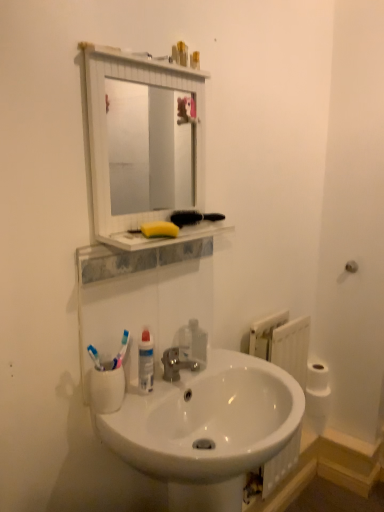
I want to click on white plastic radiator at lower right, so click(x=282, y=343).

Where is `white glossy sink at center`? This screenshot has width=384, height=512. white glossy sink at center is located at coordinates (210, 429).

The width and height of the screenshot is (384, 512). What do you see at coordinates (182, 53) in the screenshot? I see `translucent plastic container at upper center` at bounding box center [182, 53].

In order to face white matte toilet paper at right, should I rotate leftwards or rightwards?

It's best to rotate right around 16.304 degrees.

You are a GUI agent. You are given a task and a screenshot of the screen. Output one action in this format:
    pyautogui.click(x=<x>, y=<y>)
    Task: Click on the white plastic radiator at lower right
    The height and width of the screenshot is (512, 384).
    Given the screenshot: What is the action you would take?
    pyautogui.click(x=282, y=343)

Is white plastic radiator at lower right next to silver metallic faucet at center and touching it?

No, white plastic radiator at lower right is not in contact with silver metallic faucet at center.

How many degrees apart are the facing directions of white plastic radiator at lower right and silver metallic faucet at center?

The facing directions of white plastic radiator at lower right and silver metallic faucet at center are 0.598 degrees apart.

From the image's perspective, who appears lower, white plastic radiator at lower right or silver metallic faucet at center?

From the image's view, white plastic radiator at lower right is below.

Between white plastic radiator at lower right and silver metallic faucet at center, which one has less height?

Standing shorter between the two is silver metallic faucet at center.

Is yellow sponge at upper center positioned before translucent plastic container at upper center?

Yes, it is.

Between yellow sponge at upper center and translucent plastic container at upper center, which one has smaller size?

Smaller between the two is translucent plastic container at upper center.

From the image's perspective, is yellow sponge at upper center located above or below translucent plastic container at upper center?

Based on their image positions, yellow sponge at upper center is located beneath translucent plastic container at upper center.

Is yellow sponge at upper center turned away from translucent plastic container at upper center?

No, yellow sponge at upper center's orientation is not away from translucent plastic container at upper center.

From the image's perspective, would you say white plastic radiator at lower right is shown under yellow sponge at upper center?

Yes, from the image's perspective, white plastic radiator at lower right is below yellow sponge at upper center.

Where is `counter top on the left of white plastic radiator at lower right`? The height and width of the screenshot is (512, 384). counter top on the left of white plastic radiator at lower right is located at coordinates (164, 237).

Is white plastic radiator at lower right wider or thinner than yellow sponge at upper center?

In the image, white plastic radiator at lower right appears to be more narrow than yellow sponge at upper center.

Is the surface of white plastic radiator at lower right in direct contact with yellow sponge at upper center?

There is a gap between white plastic radiator at lower right and yellow sponge at upper center.

Is white glossy sink at center at the back of yellow sponge at upper center?

No.

Can you confirm if yellow sponge at upper center is wider than white glossy sink at center?

In fact, yellow sponge at upper center might be narrower than white glossy sink at center.

Who is smaller, yellow sponge at upper center or white glossy sink at center?

Smaller between the two is yellow sponge at upper center.

How much distance is there between yellow sponge at upper center and white glossy sink at center?

yellow sponge at upper center and white glossy sink at center are 21.27 inches apart.

Is silver metallic faucet at center positioned with its back to white glossy sink at center?

No, silver metallic faucet at center is not facing away from white glossy sink at center.

Is silver metallic faucet at center bigger than white glossy sink at center?

No, silver metallic faucet at center is not bigger than white glossy sink at center.

Are silver metallic faucet at center and white glossy sink at center far apart?

silver metallic faucet at center is actually quite close to white glossy sink at center.

Which is behind, silver metallic faucet at center or white glossy sink at center?

Positioned behind is silver metallic faucet at center.

Is yellow sponge at upper center surrounding silver metallic faucet at center?

No, silver metallic faucet at center is not a part of yellow sponge at upper center.

Is the surface of yellow sponge at upper center in direct contact with silver metallic faucet at center?

They are not placed beside each other.

Which of these two, yellow sponge at upper center or silver metallic faucet at center, is bigger?

With larger size is yellow sponge at upper center.

Considering the points (181, 64) and (306, 355), which point is in front, point (181, 64) or point (306, 355)?

The point (181, 64) is more forward.

Identify the location of toiletry above the white plastic radiator at lower right (from a real-world perspective). This screenshot has height=512, width=384. (182, 53).

What's the angular difference between translucent plastic container at upper center and white plastic radiator at lower right's facing directions?

The facing directions of translucent plastic container at upper center and white plastic radiator at lower right are 0.224 degrees apart.

Is translucent plastic container at upper center shorter than white plastic radiator at lower right?

Correct, translucent plastic container at upper center is not as tall as white plastic radiator at lower right.

I want to click on radiator lying on the right of silver metallic faucet at center, so click(282, 343).

This screenshot has width=384, height=512. Find the location of `counter top that is in front of the translucent plastic container at upper center`. counter top that is in front of the translucent plastic container at upper center is located at coordinates (164, 237).

Based on the photo, based on their spatial positions, is transparent plastic soap dispenser at sink or silver metallic faucet at center closer to yellow sponge at upper center?

The object closer to yellow sponge at upper center is transparent plastic soap dispenser at sink.

Based on their spatial positions, is yellow sponge at upper center or white glossy sink at center further from yellow sponge at upper center?

white glossy sink at center is positioned further to the anchor yellow sponge at upper center.

When comparing their distances from white matte toilet paper at right, does silver metallic faucet at center or yellow sponge at upper center seem further?

yellow sponge at upper center.

Which object lies nearer to the anchor point yellow sponge at upper center, white plastic radiator at lower right or white matte toilet paper at right?

white plastic radiator at lower right.

Looking at the image, which one is located further to translucent plastic container at upper center, white plastic radiator at lower right or transparent plastic soap dispenser at sink?

white plastic radiator at lower right lies further to translucent plastic container at upper center than the other object.

Based on their spatial positions, is yellow sponge at upper center or translucent plastic container at upper center closer to yellow sponge at upper center?

yellow sponge at upper center.

Considering their positions, is white matte toilet paper at right positioned further to yellow sponge at upper center than transparent plastic soap dispenser at sink?

white matte toilet paper at right is positioned further to the anchor yellow sponge at upper center.

Which object lies further to the anchor point yellow sponge at upper center, translucent plastic container at upper center or silver metallic faucet at center?

Based on the image, translucent plastic container at upper center appears to be further to yellow sponge at upper center.

Find the location of a particular element. counter top between translucent plastic container at upper center and white matte toilet paper at right vertically is located at coordinates (164, 237).

Identify the location of tap that lies between yellow sponge at upper center and white plastic radiator at lower right from top to bottom. The height and width of the screenshot is (512, 384). click(x=175, y=364).

At what (x,y) coordinates should I click in order to perform the action: click on tap between translucent plastic container at upper center and white matte toilet paper at right in the up-down direction. Please return your answer as a coordinate pair (x, y). The height and width of the screenshot is (512, 384). Looking at the image, I should click on (175, 364).

This screenshot has width=384, height=512. What are the coordinates of `tap between translucent plastic container at upper center and white plastic radiator at lower right from top to bottom` in the screenshot? It's located at (175, 364).